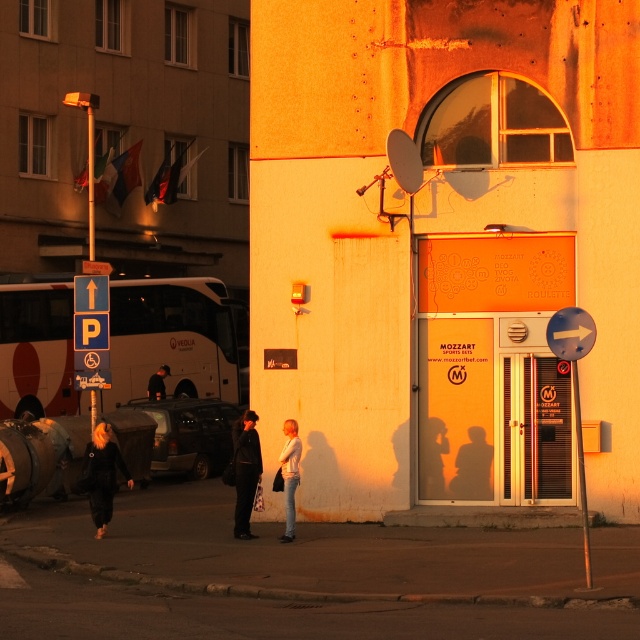
Does point (173, 368) come farther from viewer compared to point (164, 394)?

That is True.

How much distance is there between white matte bus at left and dark brown leather jacket at center?

8.78 feet

This screenshot has width=640, height=640. In order to click on white matte bus at left in this screenshot , I will do `click(177, 339)`.

The height and width of the screenshot is (640, 640). Identify the location of white matte bus at left. (177, 339).

In the scene shown: Is black leather jacket at lower left positioned behind black leather coat at center?

No, black leather jacket at lower left is closer to the viewer.

Can you confirm if black leather jacket at lower left is wider than black leather coat at center?

Yes.

Identify the location of black leather jacket at lower left. The width and height of the screenshot is (640, 640). (100, 476).

You are a GUI agent. You are given a task and a screenshot of the screen. Output one action in this format:
    pyautogui.click(x=<x>, y=<y>)
    Task: Click on the black leather jacket at lower left
    
    Given the screenshot: What is the action you would take?
    pyautogui.click(x=100, y=476)

Is white matte bus at left bigger than black leather jacket at lower left?

Indeed, white matte bus at left has a larger size compared to black leather jacket at lower left.

Looking at this image, can you confirm if white matte bus at left is wider than black leather jacket at lower left?

Yes.

Who is more distant from viewer, (36, 403) or (104, 522)?

Positioned behind is point (36, 403).

Locate an element on the screen. white matte bus at left is located at coordinates (177, 339).